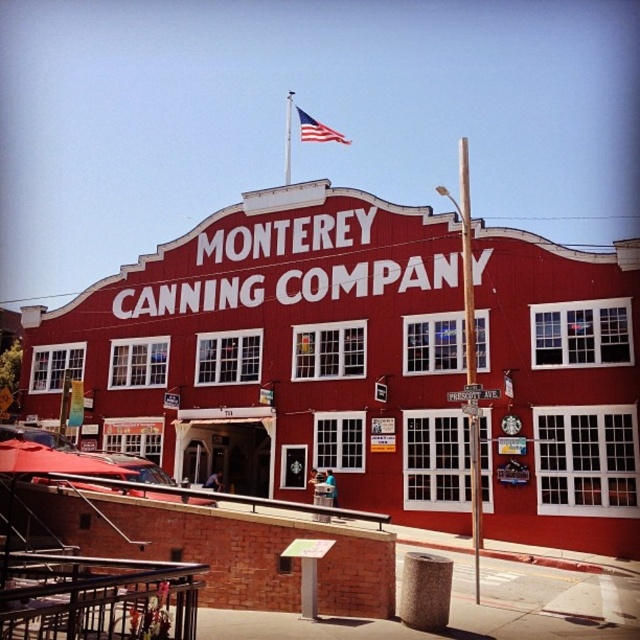
You are standing in front of the Monterey Canning Company building and want to take a photo. You have two points marked on your camera screen at coordinates point (307, 115) and point (465, 387). Which point is closer to your camera lens?

Point (307, 115) is further to the camera than point (465, 387), so the point closer to your camera lens is point (465, 387).

You are a city planner assessing the visibility of street signs. You notice the american flag at upper center and the white wooden street sign at center. Which object is taller?

The american flag at upper center is taller than the white wooden street sign at center.